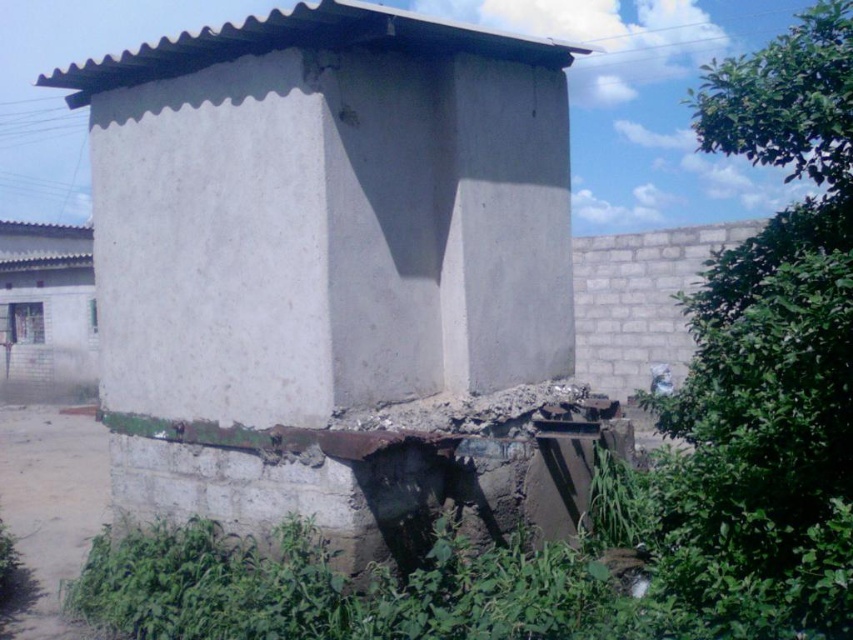
Which of these two, white concrete hut at center or white concrete hut at left, stands shorter?

Standing shorter between the two is white concrete hut at center.

The width and height of the screenshot is (853, 640). Identify the location of white concrete hut at center. (335, 275).